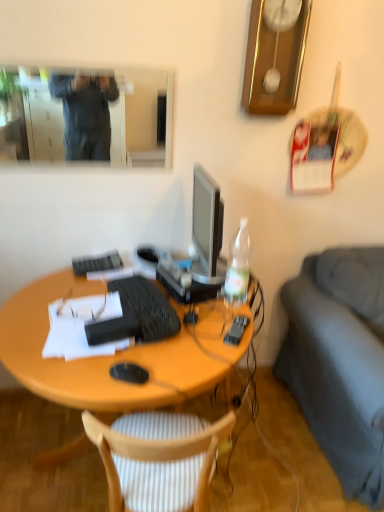
At what (x,y) coordinates should I click in order to perform the action: click on blank space to the left of black matte keyboard at center, which ranks as the 1th computer keyboard in right-to-left order. Please return your answer as a coordinate pair (x, y). The height and width of the screenshot is (512, 384). Looking at the image, I should click on (53, 300).